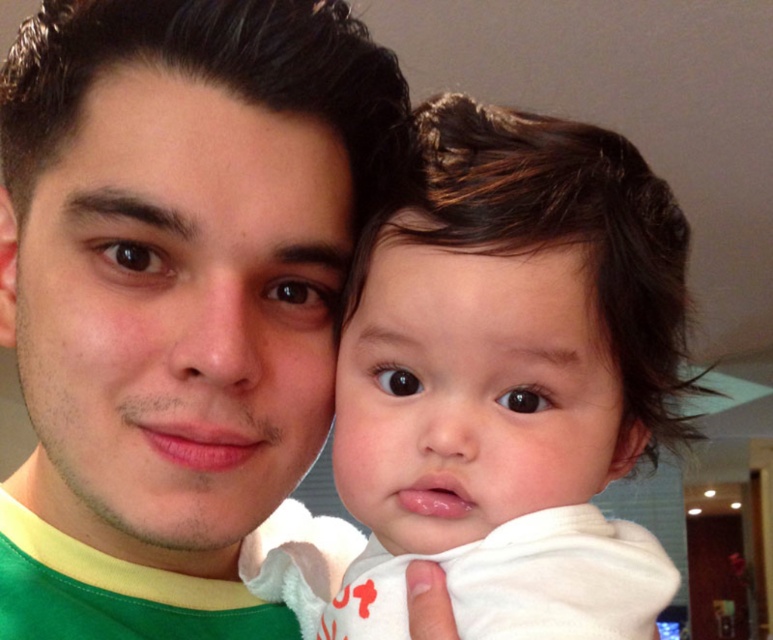
Who is positioned more to the left, green/yellow t-shirt at center or soft white towel at center?

green/yellow t-shirt at center

Who is higher up, green/yellow t-shirt at center or soft white towel at center?

Positioned higher is green/yellow t-shirt at center.

Locate an element on the screen. The width and height of the screenshot is (773, 640). green/yellow t-shirt at center is located at coordinates (174, 294).

The width and height of the screenshot is (773, 640). In order to click on green/yellow t-shirt at center in this screenshot , I will do `click(174, 294)`.